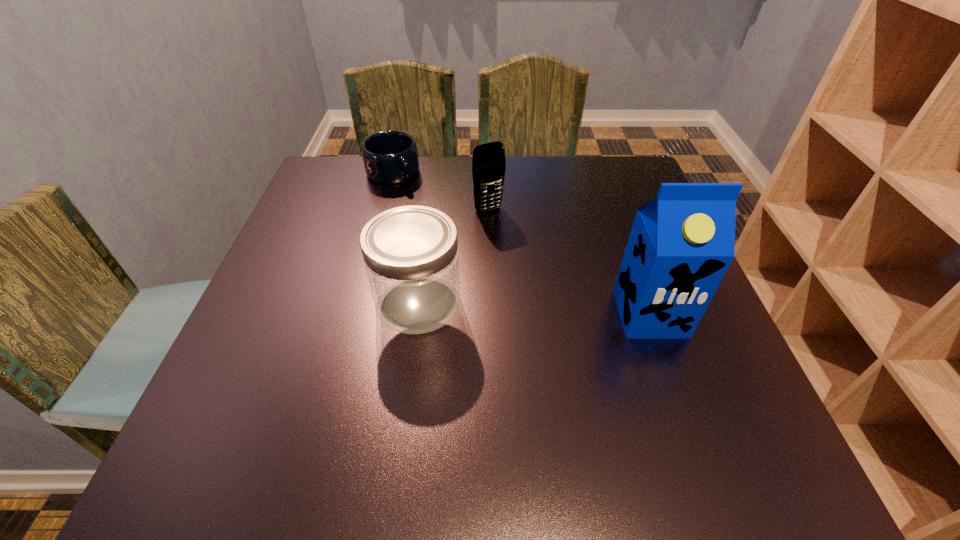
At what (x,y) coordinates should I click in order to perform the action: click on vacant space on the desktop that is between the jar and the rightmost object and is positioned on the screen of the second object from right to left. Please return your answer as a coordinate pair (x, y). The width and height of the screenshot is (960, 540). Looking at the image, I should click on (564, 310).

The height and width of the screenshot is (540, 960). I want to click on free spot on the desktop that is between the jar and the rightmost object and is positioned with the handle on the side of the mug, so click(525, 308).